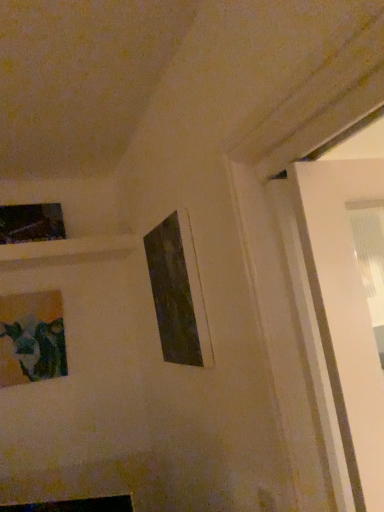
Question: Can you confirm if matte glass picture frame at lower left, the second picture frame from the right, is bigger than matte black picture frame at center, the 3th picture frame positioned from the left?

Choices:
 (A) no
 (B) yes

Answer: (A)

Question: Is the position of matte glass picture frame at lower left, which is counted as the second picture frame, starting from the front, more distant than that of matte black picture frame at center, the first picture frame from the right?

Choices:
 (A) yes
 (B) no

Answer: (A)

Question: From the image's perspective, does matte glass picture frame at lower left, which is counted as the second picture frame, starting from the front, appear lower than matte black picture frame at center, the 3th picture frame positioned from the left?

Choices:
 (A) yes
 (B) no

Answer: (A)

Question: Is matte glass picture frame at lower left, which is counted as the second picture frame, starting from the front, far away from matte black picture frame at center, the third picture frame from the back?

Choices:
 (A) yes
 (B) no

Answer: (B)

Question: From a real-world perspective, is matte glass picture frame at lower left, acting as the second picture frame starting from the back, beneath matte black picture frame at center, placed as the first picture frame when sorted from front to back?

Choices:
 (A) no
 (B) yes

Answer: (B)

Question: Can you confirm if matte glass picture frame at lower left, which is counted as the second picture frame, starting from the front, is thinner than matte black picture frame at center, the third picture frame from the back?

Choices:
 (A) no
 (B) yes

Answer: (A)

Question: From the image's perspective, is matte black picture frame at upper left, which is the 3th picture frame in right-to-left order, located beneath matte black picture frame at center, the first picture frame from the right?

Choices:
 (A) yes
 (B) no

Answer: (B)

Question: Can you confirm if matte black picture frame at upper left, the third picture frame positioned from the front, is positioned to the left of matte black picture frame at center, the third picture frame from the back?

Choices:
 (A) no
 (B) yes

Answer: (B)

Question: Is matte black picture frame at upper left, the third picture frame positioned from the front, aimed at matte black picture frame at center, the first picture frame from the right?

Choices:
 (A) yes
 (B) no

Answer: (B)

Question: Considering the relative sizes of matte black picture frame at upper left, which is the 3th picture frame in right-to-left order, and matte black picture frame at center, the 3th picture frame positioned from the left, in the image provided, is matte black picture frame at upper left, which is the 3th picture frame in right-to-left order, taller than matte black picture frame at center, the 3th picture frame positioned from the left,?

Choices:
 (A) yes
 (B) no

Answer: (B)

Question: Is the depth of matte black picture frame at upper left, which is the 3th picture frame in right-to-left order, greater than that of matte black picture frame at center, the third picture frame from the back?

Choices:
 (A) no
 (B) yes

Answer: (B)

Question: Is matte black picture frame at upper left, acting as the 1th picture frame starting from the back, shorter than matte black picture frame at center, the 3th picture frame positioned from the left?

Choices:
 (A) no
 (B) yes

Answer: (B)

Question: Considering the relative sizes of matte glass picture frame at lower left, which is the 2th picture frame from left to right, and matte black picture frame at upper left, the third picture frame positioned from the front, in the image provided, is matte glass picture frame at lower left, which is the 2th picture frame from left to right, wider than matte black picture frame at upper left, the third picture frame positioned from the front,?

Choices:
 (A) yes
 (B) no

Answer: (B)